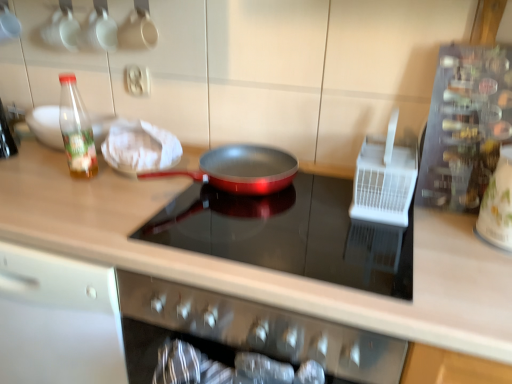
Where is `free location to the left of white glossy jar at right, arranged as the first appliance when viewed from the right`? Image resolution: width=512 pixels, height=384 pixels. free location to the left of white glossy jar at right, arranged as the first appliance when viewed from the right is located at coordinates (455, 244).